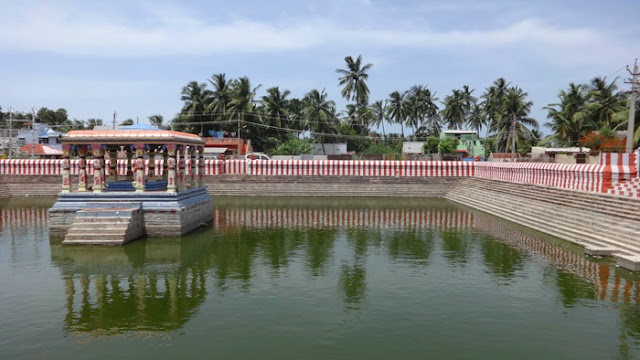
This screenshot has height=360, width=640. What are the coordinates of `stairs` in the screenshot? It's located at (570, 237).